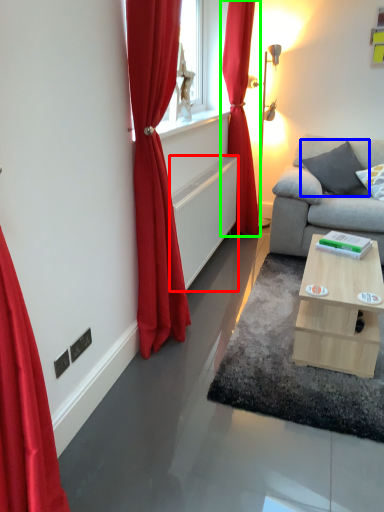
Question: Which is farther away from radiator (highlighted by a red box)? pillow (highlighted by a blue box) or curtain (highlighted by a green box)?

Choices:
 (A) pillow
 (B) curtain

Answer: (A)